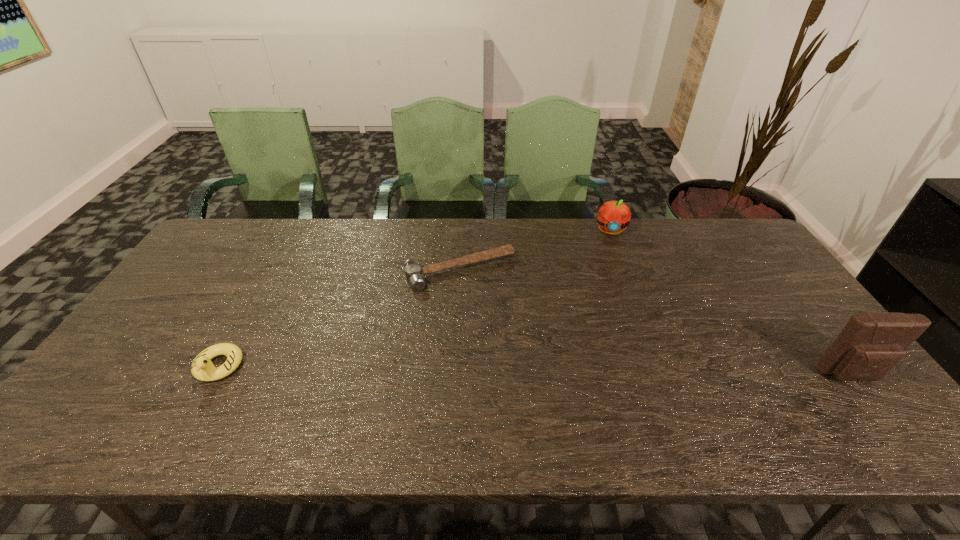
Where is `unoccupied position between the shortest object and the rightmost object`? The height and width of the screenshot is (540, 960). unoccupied position between the shortest object and the rightmost object is located at coordinates coord(656,323).

Where is `free space that is in between the farthest object and the leftmost object`? The image size is (960, 540). free space that is in between the farthest object and the leftmost object is located at coordinates (414, 299).

Locate an element on the screen. empty space that is in between the hammer and the third tallest object is located at coordinates (339, 319).

I want to click on empty space between the rightmost object and the duckling, so click(535, 371).

I want to click on vacant region between the hammer and the rightmost object, so click(656, 323).

Locate which object ranks second in proximity to the leftmost object. Please provide its 2D coordinates. Your answer should be formatted as a tuple, i.e. [(x, y)], where the tuple contains the x and y coordinates of a point satisfying the conditions above.

[(613, 216)]

Identify which object is located as the nearest to the pouch. Please provide its 2D coordinates. Your answer should be formatted as a tuple, i.e. [(x, y)], where the tuple contains the x and y coordinates of a point satisfying the conditions above.

[(613, 216)]

This screenshot has height=540, width=960. In order to click on vacant space that satisfies the following two spatial constraints: 1. on the back side of the apple; 2. on the right side of the hammer in this screenshot , I will do `click(462, 231)`.